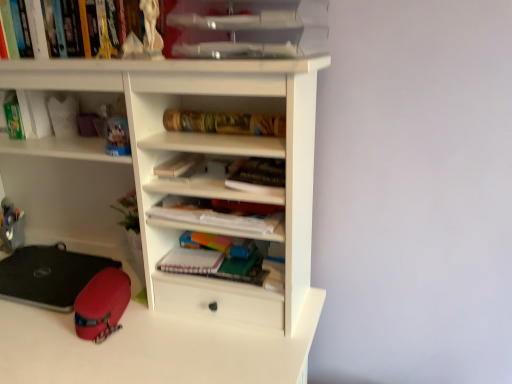
Locate an element on the screen. This screenshot has height=384, width=512. blank space situated above rubberized red case at lower left (from a real-world perspective) is located at coordinates (97, 281).